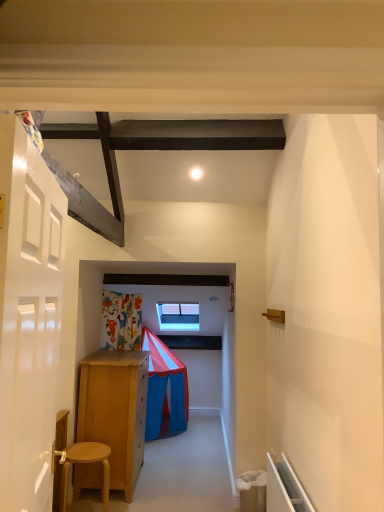
Question: Looking at their shapes, would you say light brown wooden stool at lower left is wider or thinner than white glossy door at left?

Choices:
 (A) thin
 (B) wide

Answer: (B)

Question: From a real-world perspective, relative to white glossy door at left, is light brown wooden stool at lower left vertically above or below?

Choices:
 (A) above
 (B) below

Answer: (B)

Question: From their relative heights in the image, would you say light brown wooden stool at lower left is taller or shorter than white glossy door at left?

Choices:
 (A) short
 (B) tall

Answer: (A)

Question: Considering the positions of white glossy door at left and light brown wooden stool at lower left in the image, is white glossy door at left bigger or smaller than light brown wooden stool at lower left?

Choices:
 (A) small
 (B) big

Answer: (B)

Question: From the image's perspective, is white glossy door at left above or below light brown wooden stool at lower left?

Choices:
 (A) below
 (B) above

Answer: (B)

Question: In the image, is white glossy door at left on the left side or the right side of light brown wooden stool at lower left?

Choices:
 (A) right
 (B) left

Answer: (A)

Question: From a real-world perspective, is white glossy door at left positioned above or below light brown wooden stool at lower left?

Choices:
 (A) below
 (B) above

Answer: (B)